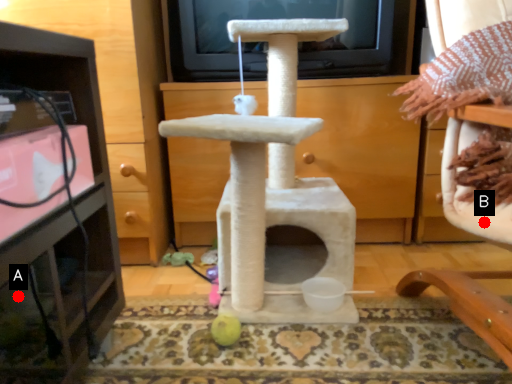
Question: Two points are circled on the image, labeled by A and B beside each circle. Which of the following is the farthest from the observer?

Choices:
 (A) A is further
 (B) B is further

Answer: (B)